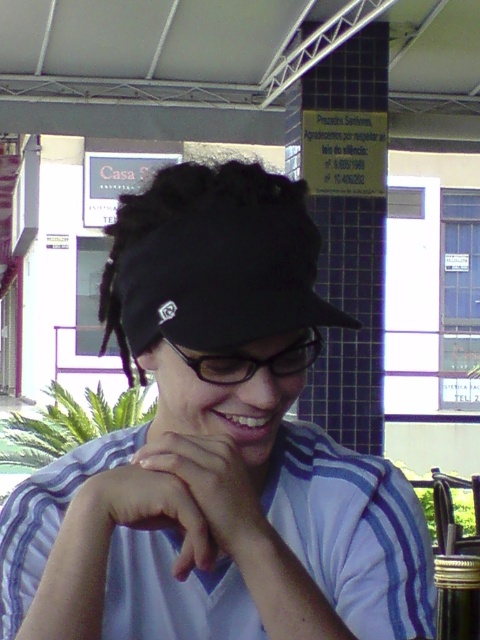
You are standing in the market area and want to determine the distance between two specific points. The first point is point [286,513] and the second is point [251,545]. Which point is closer to you?

Point [251,545] is closer to you because it is less further than point [286,513].

You are a photographer trying to capture the perfect shot of the person in the scene. You notice the white striped polo shirt at center and the white matte hand at center. Which object should you focus on first if you want to capture the subject from left to right?

You should focus on the white striped polo shirt at center first because it is positioned to the left of the white matte hand at center, so when moving from left to right, the white striped polo shirt at center comes first.